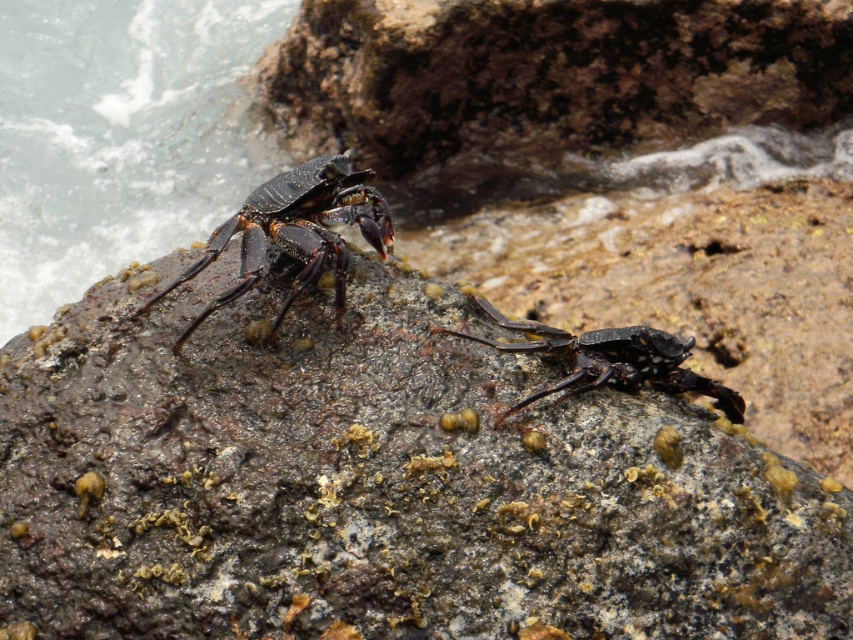
Question: Which object appears farthest from the camera in this image?

Choices:
 (A) clear water at left
 (B) rough textured rock at center

Answer: (A)

Question: Is clear water at left positioned behind shiny black crab at center?

Choices:
 (A) yes
 (B) no

Answer: (A)

Question: Can you confirm if shiny black crab at upper left is positioned below shiny black crab at center?

Choices:
 (A) yes
 (B) no

Answer: (B)

Question: Which object is the farthest from the rough textured rock at center?

Choices:
 (A) shiny black crab at upper left
 (B) clear water at left
 (C) shiny black crab at center

Answer: (B)

Question: Estimate the real-world distances between objects in this image. Which object is farther from the rough textured rock at center?

Choices:
 (A) clear water at left
 (B) shiny black crab at upper left
 (C) shiny black crab at center

Answer: (A)

Question: Is clear water at left below shiny black crab at upper left?

Choices:
 (A) no
 (B) yes

Answer: (A)